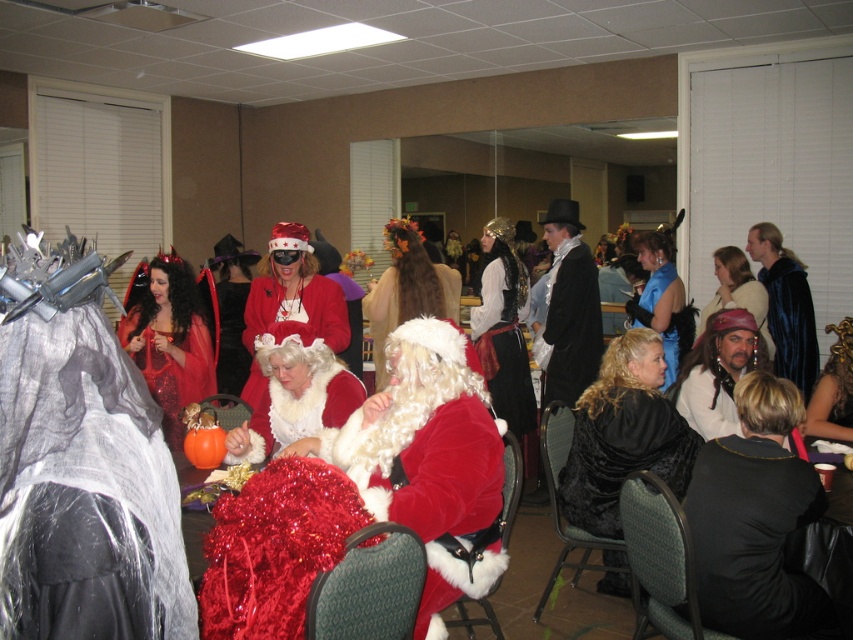
Is fuzzy red santa at center thinner than velvet blue cape at right?

In fact, fuzzy red santa at center might be wider than velvet blue cape at right.

In the scene shown: Does fuzzy red santa at center have a lesser height compared to velvet blue cape at right?

Yes, fuzzy red santa at center is shorter than velvet blue cape at right.

Between point (59, 554) and point (793, 371), which one is positioned in front?

Positioned in front is point (59, 554).

Where is `fuzzy red santa at center`? The width and height of the screenshot is (853, 640). fuzzy red santa at center is located at coordinates (80, 461).

Between fuzzy red santa at center and velvet santa claus at center, which one appears on the left side from the viewer's perspective?

Positioned to the left is fuzzy red santa at center.

The image size is (853, 640). Find the location of `fuzzy red santa at center`. fuzzy red santa at center is located at coordinates (80, 461).

Is point (68, 289) farther from camera compared to point (386, 477)?

No, (68, 289) is in front of (386, 477).

Identify the location of fuzzy red santa at center. (80, 461).

Between point (428, 477) and point (685, 413), which one is positioned in front?

Positioned in front is point (428, 477).

Which is above, velvet santa claus at center or white fluffy wig at center?

white fluffy wig at center

Which is behind, point (434, 445) or point (708, 401)?

The point (708, 401) is more distant.

At what (x,y) coordinates should I click in order to perform the action: click on velvet santa claus at center. Please return your answer as a coordinate pair (x, y). This screenshot has height=640, width=853. Looking at the image, I should click on (438, 493).